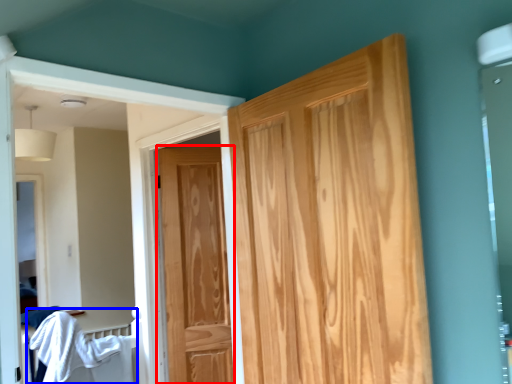
Question: Which of the following is the closest to the observer, door (highlighted by a red box) or bed (highlighted by a blue box)?

Choices:
 (A) door
 (B) bed

Answer: (B)